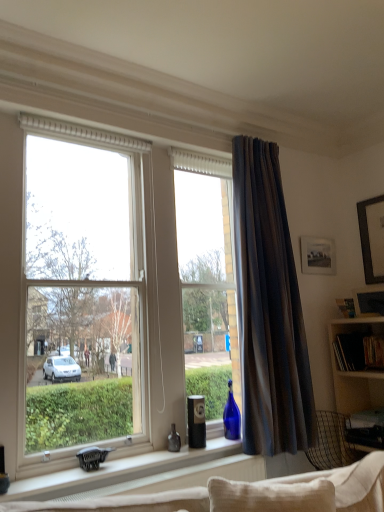
Question: Is dark grey textured curtain at right positioned beyond the bounds of white matte window sill at center?

Choices:
 (A) yes
 (B) no

Answer: (A)

Question: Considering the relative sizes of dark grey textured curtain at right and white matte window sill at center in the image provided, is dark grey textured curtain at right bigger than white matte window sill at center?

Choices:
 (A) yes
 (B) no

Answer: (A)

Question: Can you confirm if dark grey textured curtain at right is smaller than white matte window sill at center?

Choices:
 (A) no
 (B) yes

Answer: (A)

Question: Is dark grey textured curtain at right aimed at white matte window sill at center?

Choices:
 (A) no
 (B) yes

Answer: (A)

Question: From the image's perspective, is dark grey textured curtain at right located beneath white matte window sill at center?

Choices:
 (A) no
 (B) yes

Answer: (A)

Question: From their relative heights in the image, would you say wooden picture frame at upper right, the 1th picture frame in the front-to-back sequence, is taller or shorter than transparent glass window at center?

Choices:
 (A) tall
 (B) short

Answer: (B)

Question: Considering the relative positions of wooden picture frame at upper right, acting as the second picture frame starting from the back, and transparent glass window at center in the image provided, is wooden picture frame at upper right, acting as the second picture frame starting from the back, to the left or to the right of transparent glass window at center?

Choices:
 (A) left
 (B) right

Answer: (B)

Question: Is wooden picture frame at upper right, the 2th picture frame in the top-to-bottom sequence, bigger or smaller than transparent glass window at center?

Choices:
 (A) small
 (B) big

Answer: (A)

Question: From the image's perspective, relative to transparent glass window at center, is wooden picture frame at upper right, the 1th picture frame in the front-to-back sequence, above or below?

Choices:
 (A) below
 (B) above

Answer: (A)

Question: From a real-world perspective, is transparent glass window at center physically located above or below matte glass bottle at window sill?

Choices:
 (A) above
 (B) below

Answer: (A)

Question: Considering the positions of transparent glass window at center and matte glass bottle at window sill in the image, is transparent glass window at center taller or shorter than matte glass bottle at window sill?

Choices:
 (A) short
 (B) tall

Answer: (B)

Question: Looking at the image, does transparent glass window at center seem bigger or smaller compared to matte glass bottle at window sill?

Choices:
 (A) big
 (B) small

Answer: (A)

Question: Considering the relative positions of transparent glass window at center and matte glass bottle at window sill in the image provided, is transparent glass window at center to the left or to the right of matte glass bottle at window sill?

Choices:
 (A) left
 (B) right

Answer: (A)

Question: From a real-world perspective, relative to dark grey textured curtain at right, is transparent glass window at center vertically above or below?

Choices:
 (A) below
 (B) above

Answer: (A)

Question: Is transparent glass window at center in front of or behind dark grey textured curtain at right in the image?

Choices:
 (A) front
 (B) behind

Answer: (A)